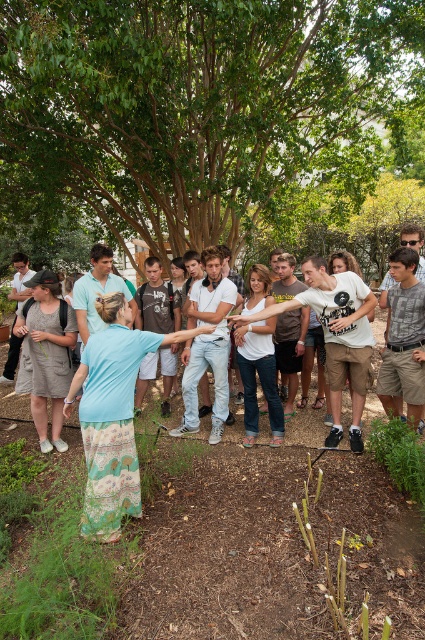
Question: In this image, where is light blue fabric skirt at lower left located relative to white fabric shirt at center?

Choices:
 (A) left
 (B) right

Answer: (A)

Question: Can you confirm if light blue fabric skirt at lower left is positioned below white fabric shirt at center?

Choices:
 (A) no
 (B) yes

Answer: (B)

Question: Which point appears closest to the camera in this image?

Choices:
 (A) click(x=340, y=292)
 (B) click(x=119, y=13)
 (C) click(x=87, y=422)

Answer: (C)

Question: Is green leafy tree at center positioned before white fabric shirt at center?

Choices:
 (A) yes
 (B) no

Answer: (B)

Question: Which object is closer to the camera taking this photo?

Choices:
 (A) light blue fabric skirt at lower left
 (B) green leafy tree at center
 (C) white fabric shirt at center

Answer: (A)

Question: Which point is farther from the camera taking this photo?

Choices:
 (A) (345, 296)
 (B) (297, 164)
 (C) (122, 422)

Answer: (B)